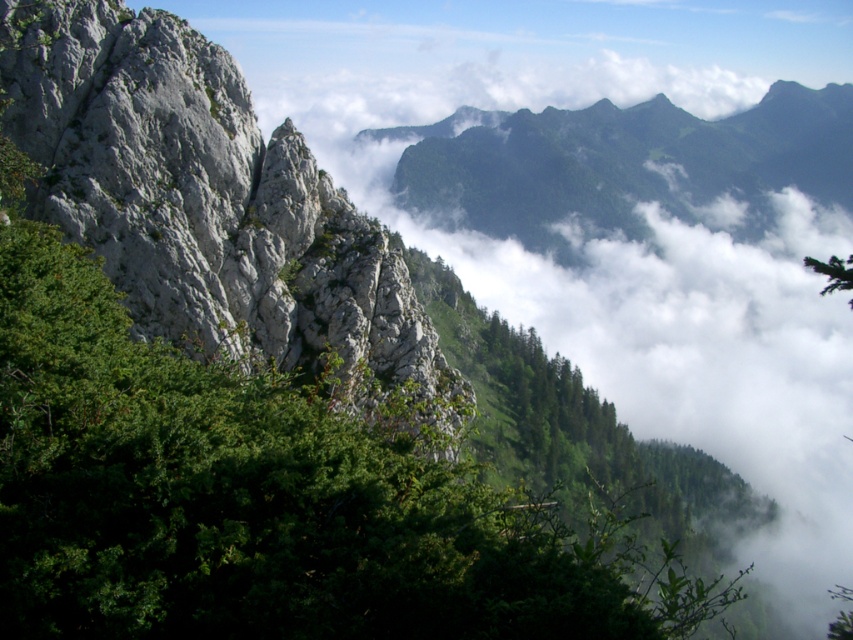
You are standing in the mountain landscape and see a point marked at coordinates (210, 205). What type of surface is this point located on?

The point at (210, 205) is located on the gray rough rock at left.

You are a hiker planning to cross from the gray rough rock at left to the green leafy tree at upper right. Given that your average stride is 2.5 feet, how many steps would you need to take to reach the tree from the rock?

The gray rough rock at left and green leafy tree at upper right are 103.13 feet apart. Dividing the distance by the stride length of 2.5 feet gives approximately 41.25 steps. Since you can only take whole steps, you would need to take 42 steps to reach the green leafy tree at upper right from the gray rough rock at left.

You are a hiker trying to navigate through the mountainous landscape. You notice a gray rough rock at left. Based on its position, can you determine if it is closer to you or further away compared to the dense cluster of green foliage in the foreground?

The gray rough rock at left is located at point coordinates which are typically closer to the viewer in such scenes, but since the dense cluster of green foliage is explicitly mentioned as being in the foreground, the foliage is closer. Therefore, the gray rough rock at left is further away than the foliage.